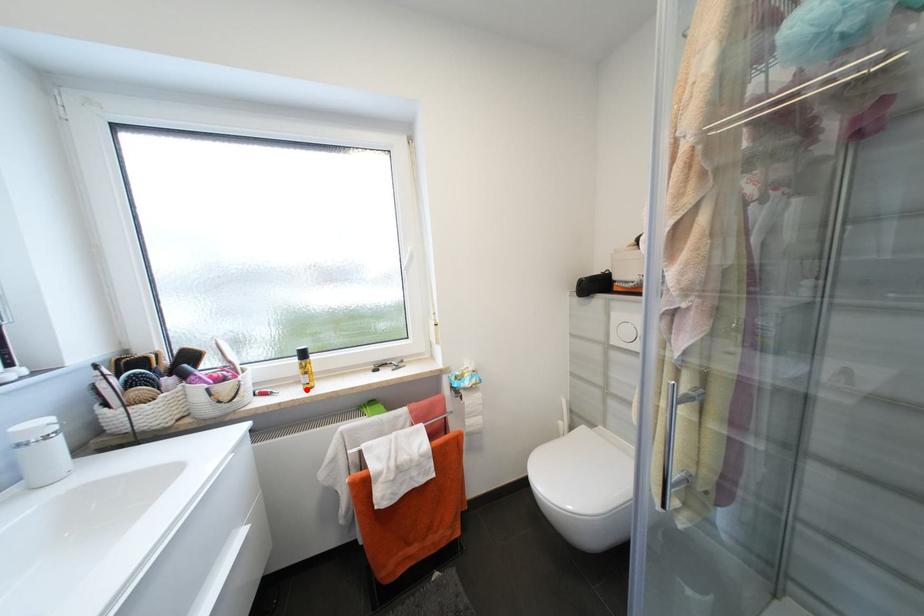
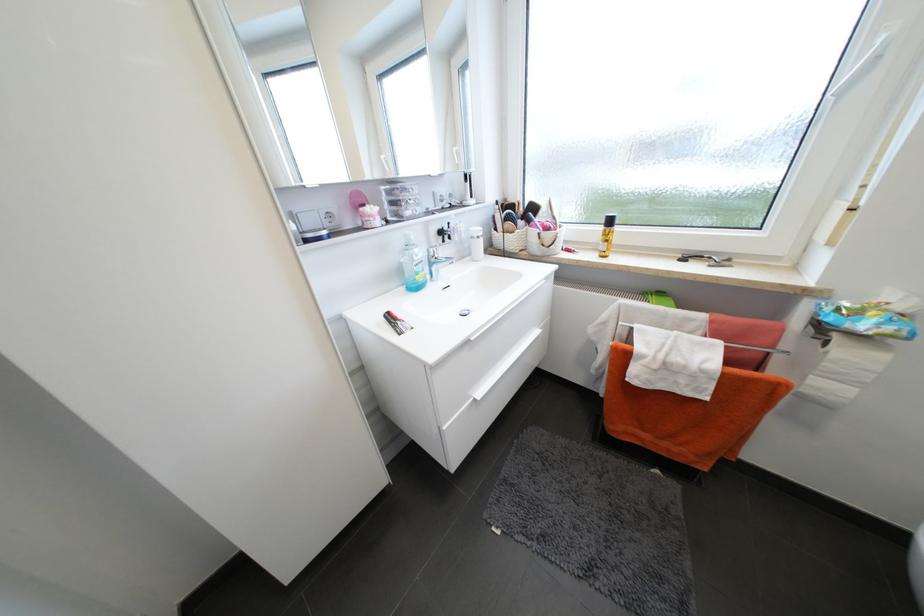
Where in the second image is the point corresponding to the highlighted location from the first image?

(602, 256)